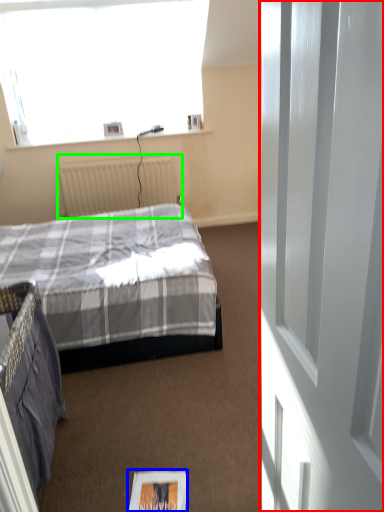
Question: Which object is positioned closest to screen door (highlighted by a red box)? Select from magazine (highlighted by a blue box) and radiator (highlighted by a green box).

Choices:
 (A) magazine
 (B) radiator

Answer: (A)